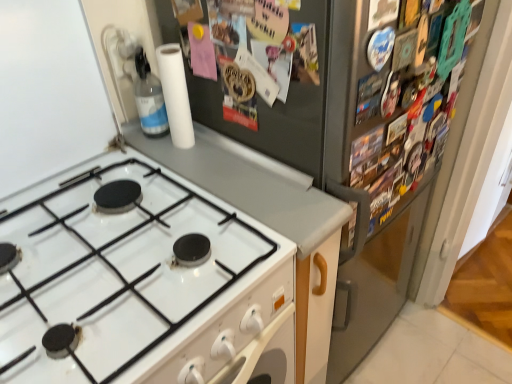
Question: From the image's perspective, relative to white glossy gas stove at lower left, is satin silver fridge at upper right above or below?

Choices:
 (A) below
 (B) above

Answer: (B)

Question: From a real-world perspective, relative to white glossy gas stove at lower left, is satin silver fridge at upper right vertically above or below?

Choices:
 (A) above
 (B) below

Answer: (B)

Question: Based on their relative distances, which object is farther from the white glossy gas stove at lower left?

Choices:
 (A) white matte paper towel at upper center
 (B) transparent plastic bottle at upper left
 (C) white matte countertop at center
 (D) satin silver fridge at upper right

Answer: (B)

Question: Based on their relative distances, which object is farther from the white matte countertop at center?

Choices:
 (A) white glossy gas stove at lower left
 (B) transparent plastic bottle at upper left
 (C) white matte paper towel at upper center
 (D) satin silver fridge at upper right

Answer: (B)